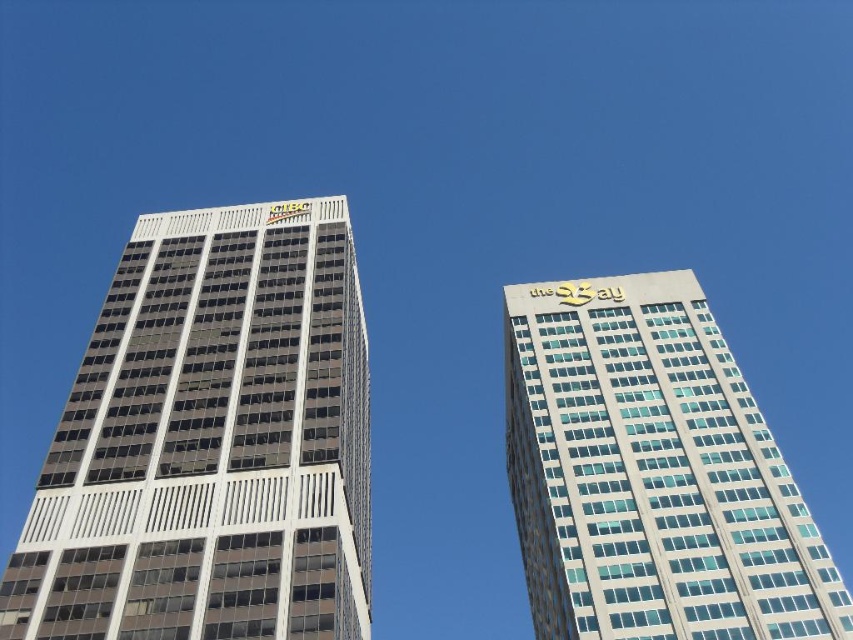
Can you confirm if matte glass building at left is wider than white glass building at right?

Indeed, matte glass building at left has a greater width compared to white glass building at right.

At what (x,y) coordinates should I click in order to perform the action: click on matte glass building at left. Please return your answer as a coordinate pair (x, y). The image size is (853, 640). Looking at the image, I should click on (210, 442).

The width and height of the screenshot is (853, 640). Find the location of `matte glass building at left`. matte glass building at left is located at coordinates (210, 442).